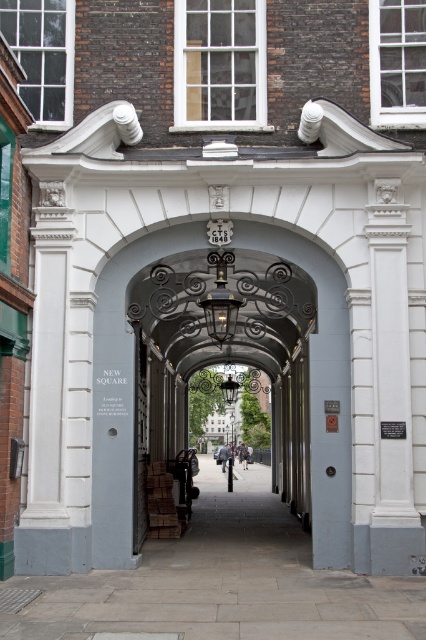
Question: Among these points, which one is farthest from the camera?

Choices:
 (A) (336, 536)
 (B) (40, 211)

Answer: (B)

Question: Can you confirm if smooth stone alley at center is positioned to the left of white stone pillar at left?

Choices:
 (A) no
 (B) yes

Answer: (A)

Question: Which object is closer to the camera taking this photo?

Choices:
 (A) smooth stone alley at center
 (B) smooth gray archway at center
 (C) white stone pillar at left

Answer: (A)

Question: Is smooth stone alley at center below white stone pillar at left?

Choices:
 (A) yes
 (B) no

Answer: (A)

Question: Which point is closer to the camera taking this photo?

Choices:
 (A) (399, 580)
 (B) (60, 202)
 (C) (124, 436)

Answer: (A)

Question: Is the position of smooth stone alley at center more distant than that of white stone pillar at left?

Choices:
 (A) no
 (B) yes

Answer: (A)